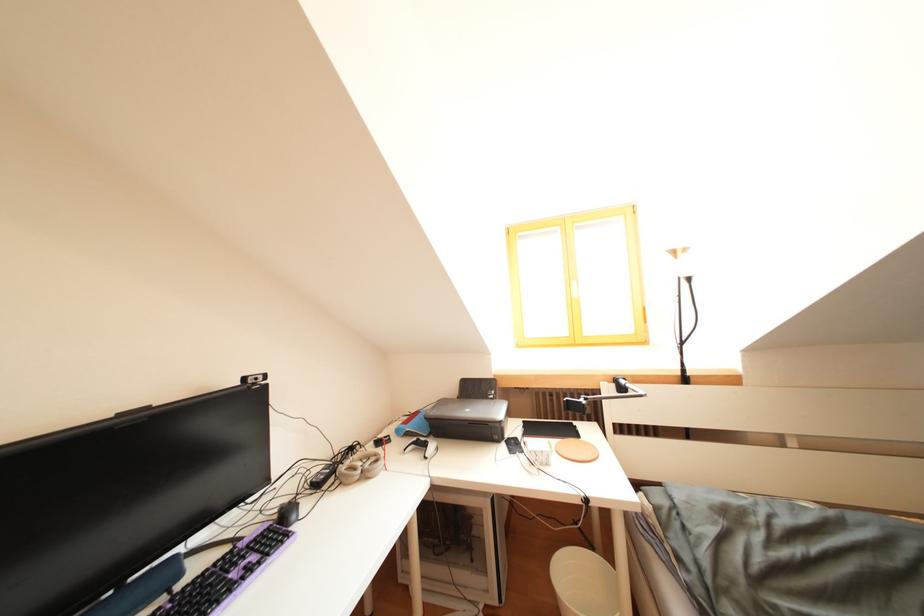
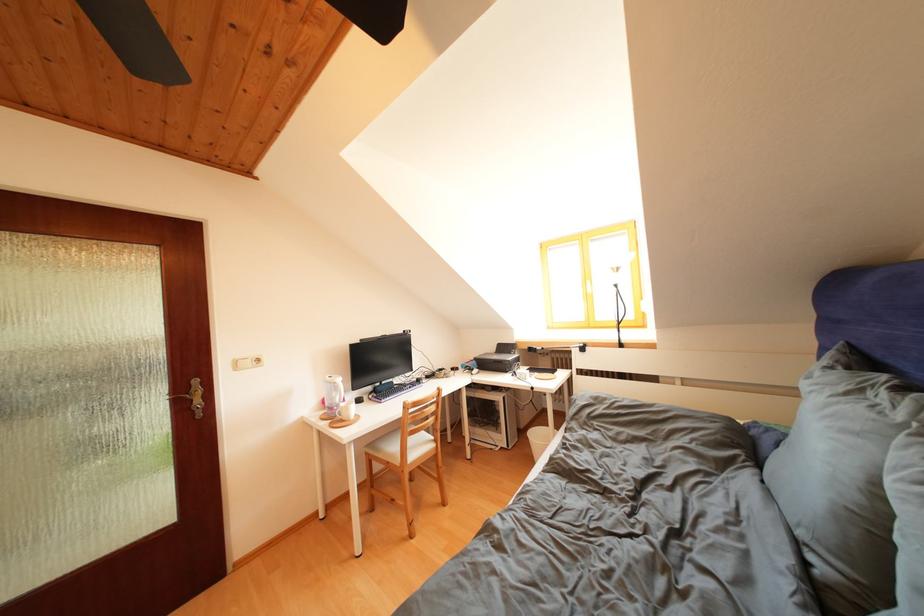
Where in the second image is the point corresponding to (x=492, y=400) from the first image?

(517, 358)